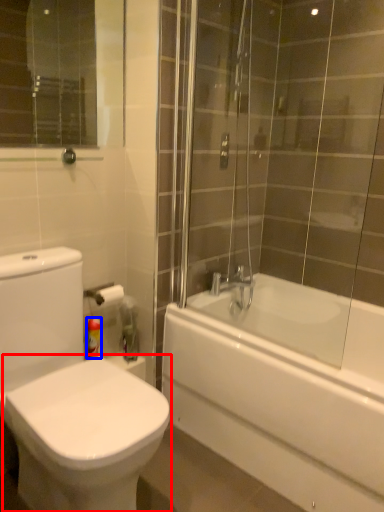
Question: Which object is closer to the camera taking this photo, bidet (highlighted by a red box) or toiletry (highlighted by a blue box)?

Choices:
 (A) bidet
 (B) toiletry

Answer: (A)